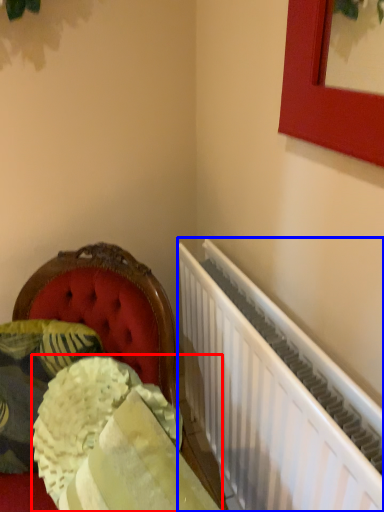
Question: Which object is further to the camera taking this photo, material (highlighted by a red box) or radiator (highlighted by a blue box)?

Choices:
 (A) material
 (B) radiator

Answer: (B)